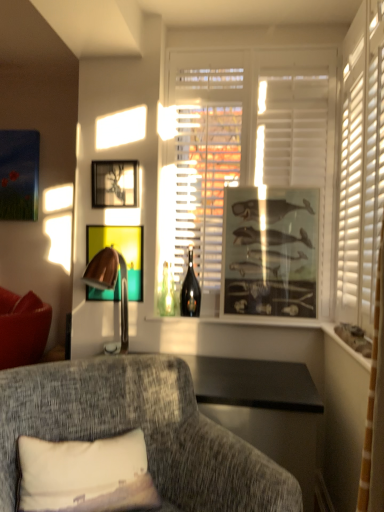
Question: Is metallic gold picture frame at center, positioned as the second picture frame in left-to-right order, in front of or behind copper metallic table lamp at left in the image?

Choices:
 (A) front
 (B) behind

Answer: (B)

Question: Is metallic gold picture frame at center, positioned as the second picture frame in left-to-right order, wider or thinner than copper metallic table lamp at left?

Choices:
 (A) thin
 (B) wide

Answer: (A)

Question: Estimate the real-world distances between objects in this image. Which object is closer to the textured gray couch at lower left?

Choices:
 (A) matte glass window sill at right, the first window sill positioned from the front
 (B) shiny dark glass wine bottle at center
 (C) white matte window at center
 (D) metallic gold picture frame at center, positioned as the second picture frame in left-to-right order
 (E) copper metallic table lamp at left

Answer: (E)

Question: Which is farther from the matte glass window sill at right, marked as the 1th window sill in a right-to-left arrangement?

Choices:
 (A) copper metallic table lamp at left
 (B) textured gray couch at lower left
 (C) white fabric pillow at lower left
 (D) metallic silver picture frame at upper center, marked as the 3th picture frame in a right-to-left arrangement
 (E) metallic gold picture frame at center, acting as the 2th picture frame starting from the right

Answer: (D)